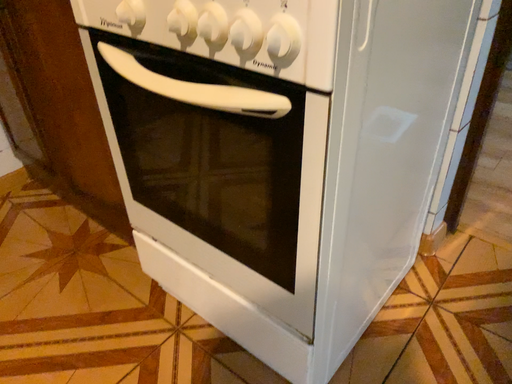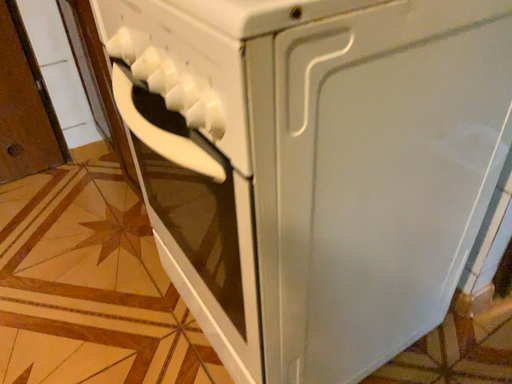
Question: Which way did the camera rotate in the video?

Choices:
 (A) rotated left
 (B) rotated right

Answer: (A)